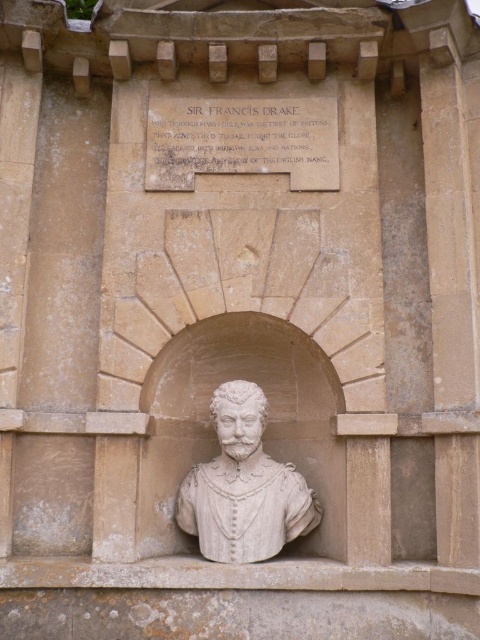
You are an art conservator examining the monument. You need to clean both the matte stone plaque at upper center and the white stone bust at center. Which object should you clean first if you want to start with the one closer to you?

The matte stone plaque at upper center should be cleaned first because it is closer to you than the white stone bust at center.

In the scene shown: You are standing in front of the Sir Francis Drake monument. You want to read the inscription on the matte stone plaque at upper center. Where should you look to find it?

The matte stone plaque at upper center is located at point (241, 140), so you should look there to read the inscription.

What is the significance of the point located at coordinates (241, 140) on the monument?

The point at coordinates (241, 140) is on the matte stone plaque at upper center, which contains the inscription highlighting Sir Francis Drake as the first Briton to sail around the globe through perilous seas and nations.